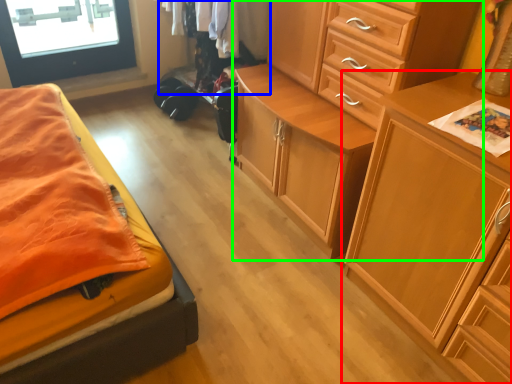
Question: Estimate the real-world distances between objects in this image. Which object is closer to chest of drawers (highlighted by a red box), clothing (highlighted by a blue box) or chest of drawers (highlighted by a green box)?

Choices:
 (A) clothing
 (B) chest of drawers

Answer: (B)